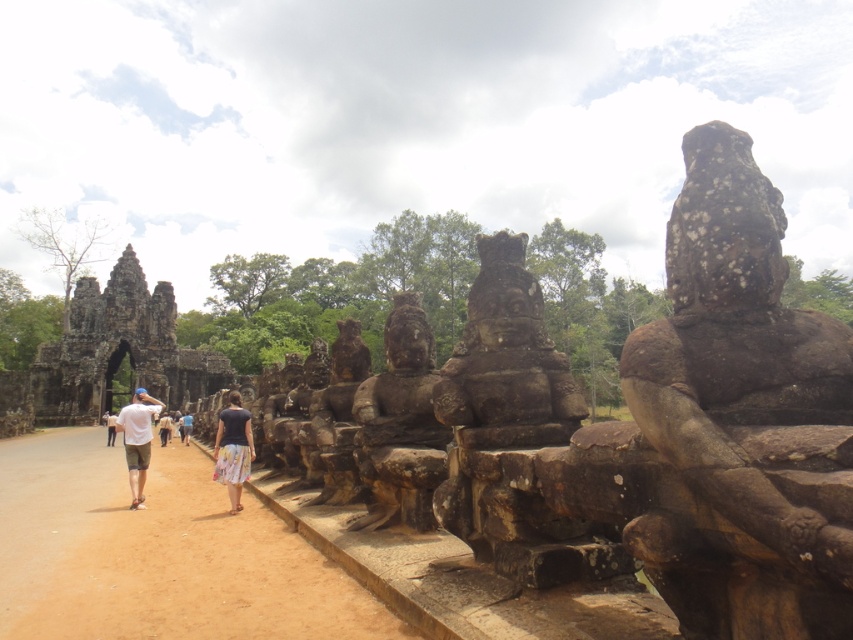
Question: Does rough stone statue at center appear on the right side of white cotton shirt at left?

Choices:
 (A) yes
 (B) no

Answer: (A)

Question: Is rough stone statue at right smaller than floral skirt at center?

Choices:
 (A) yes
 (B) no

Answer: (A)

Question: Estimate the real-world distances between objects in this image. Which object is farther from the light brown fabric dress at center?

Choices:
 (A) rough stone statue at center
 (B) floral skirt at center
 (C) rough stone statue at right

Answer: (C)

Question: Which point is farther to the camera?

Choices:
 (A) (357, 440)
 (B) (242, 413)
 (C) (519, 288)
 (D) (824, 531)

Answer: (B)

Question: Considering the relative positions of rough stone statue at right and brown stone statue at center in the image provided, where is rough stone statue at right located with respect to brown stone statue at center?

Choices:
 (A) left
 (B) right

Answer: (B)

Question: Which object is closer to the camera taking this photo?

Choices:
 (A) floral skirt at center
 (B) rough stone statue at right
 (C) brown stone statue at center

Answer: (B)